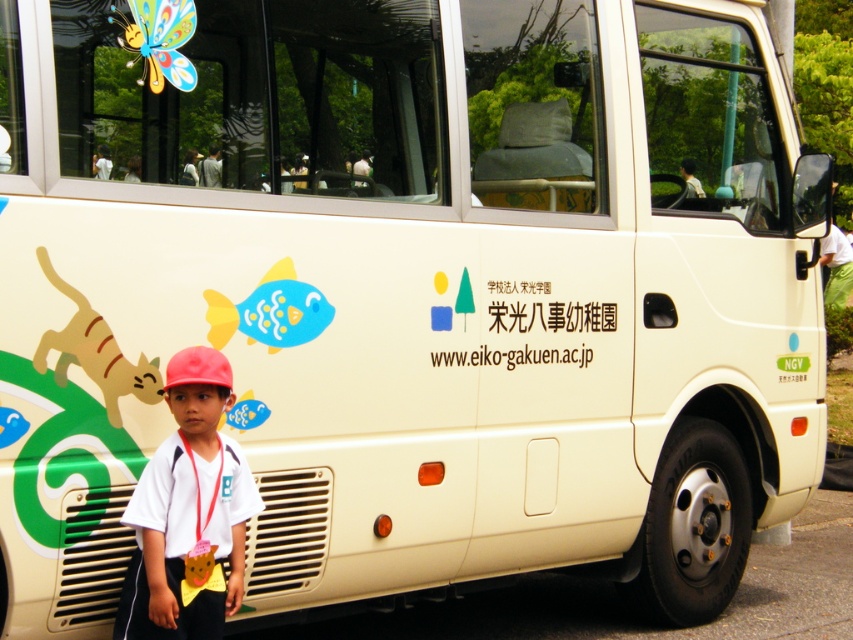
Question: Is white matte shirt at lower left positioned at the back of white paper sign at center?

Choices:
 (A) yes
 (B) no

Answer: (B)

Question: Can you confirm if white matte shirt at lower left is positioned to the right of white paper sign at center?

Choices:
 (A) yes
 (B) no

Answer: (B)

Question: Is white matte shirt at lower left smaller than white paper sign at center?

Choices:
 (A) yes
 (B) no

Answer: (A)

Question: Which object appears farthest from the camera in this image?

Choices:
 (A) white matte shirt at lower left
 (B) white paper sign at center

Answer: (B)

Question: Which of the following is the farthest from the observer?

Choices:
 (A) (223, 460)
 (B) (480, 362)

Answer: (B)